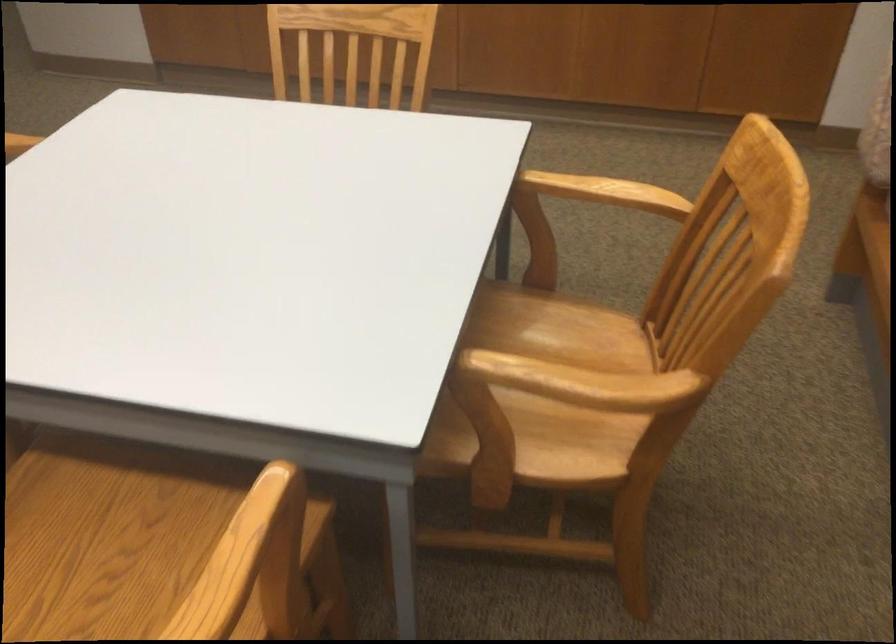
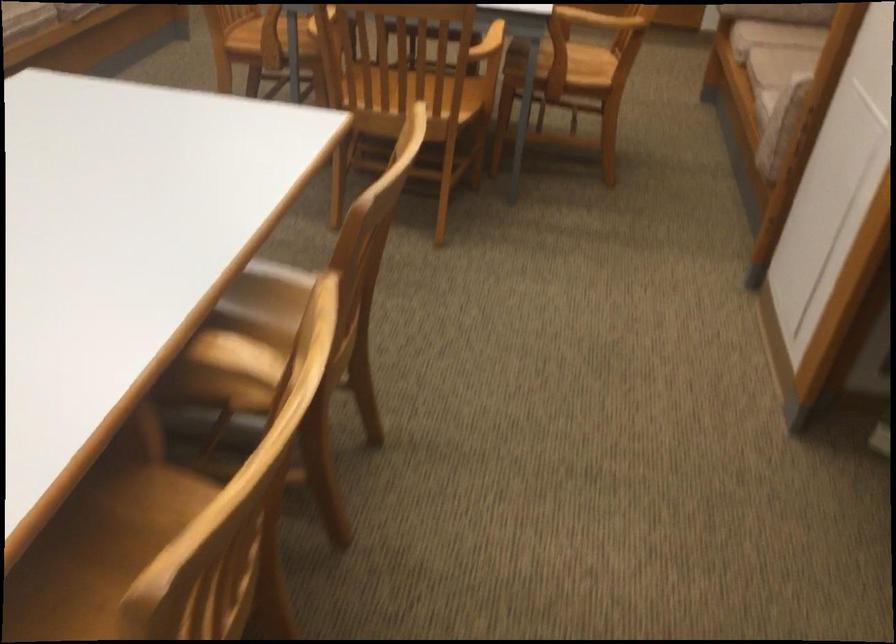
Find the pixel in the second image that matches (533,448) in the first image.

(570, 69)